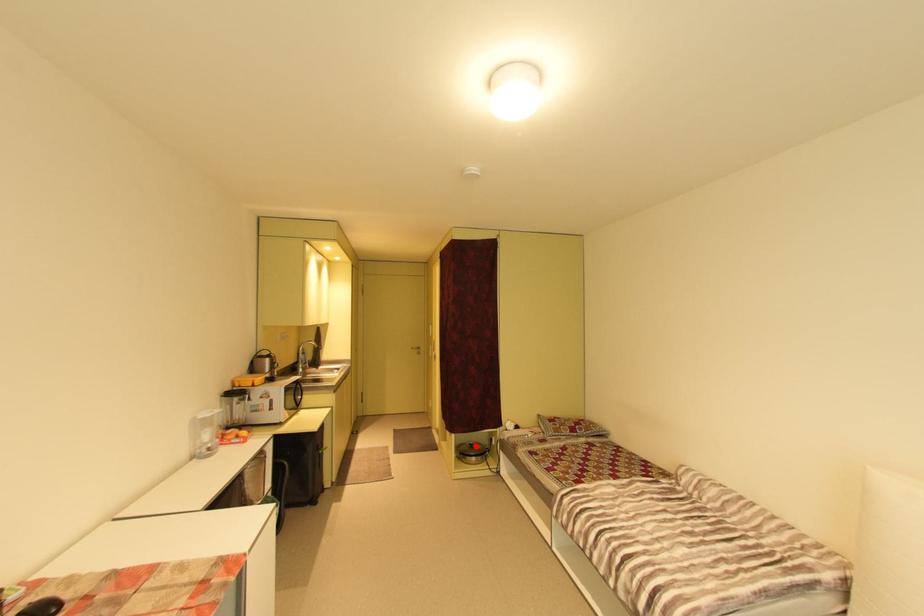
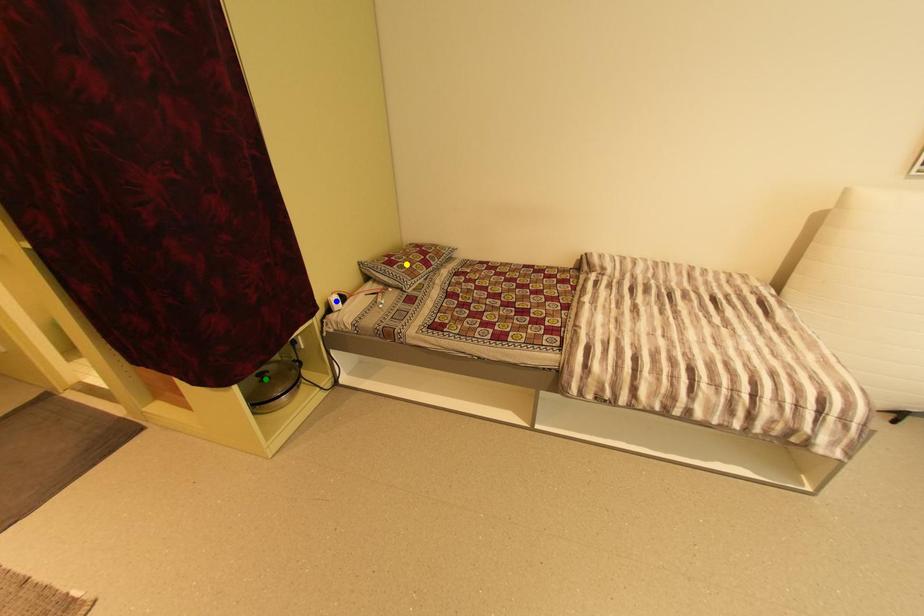
Question: I am providing you with two images of the same scene from different viewpoints. A red point is marked on the first image. You are given multiple points on the second image. Which point in image 2 is actually the same real-world point as the red point in image 1?

Choices:
 (A) green point
 (B) yellow point
 (C) blue point

Answer: (A)